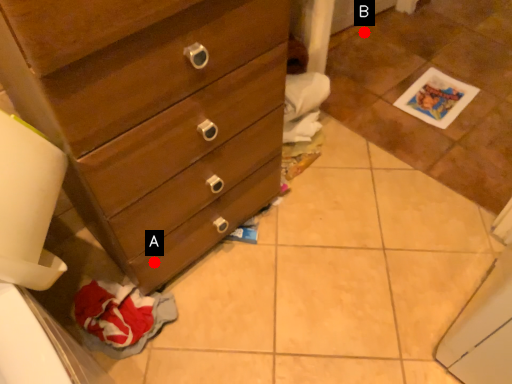
Question: Two points are circled on the image, labeled by A and B beside each circle. Which point is further to the camera?

Choices:
 (A) A is further
 (B) B is further

Answer: (B)